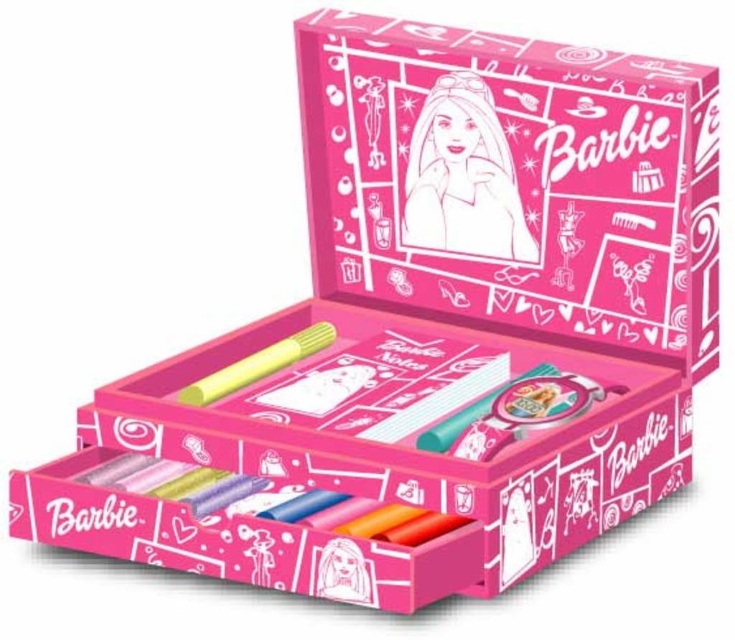
Can you confirm if pink paper doll at center is positioned above yellow matte crayon at center?

Indeed, pink paper doll at center is positioned over yellow matte crayon at center.

Between pink paper doll at center and yellow matte crayon at center, which one has less height?

yellow matte crayon at center is shorter.

Between point (526, 241) and point (261, 365), which one is positioned behind?

The point (526, 241) is behind.

The width and height of the screenshot is (735, 640). In order to click on pink paper doll at center in this screenshot , I will do `click(462, 177)`.